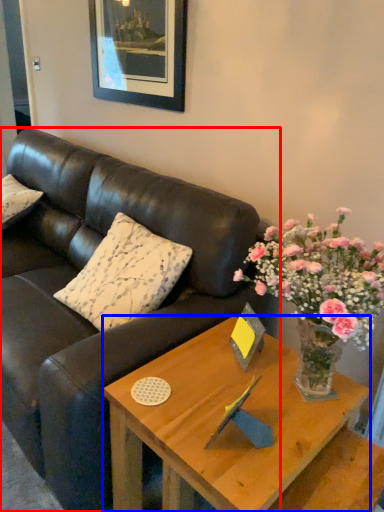
Question: Which object is further to the camera taking this photo, studio couch (highlighted by a red box) or coffee table (highlighted by a blue box)?

Choices:
 (A) studio couch
 (B) coffee table

Answer: (A)